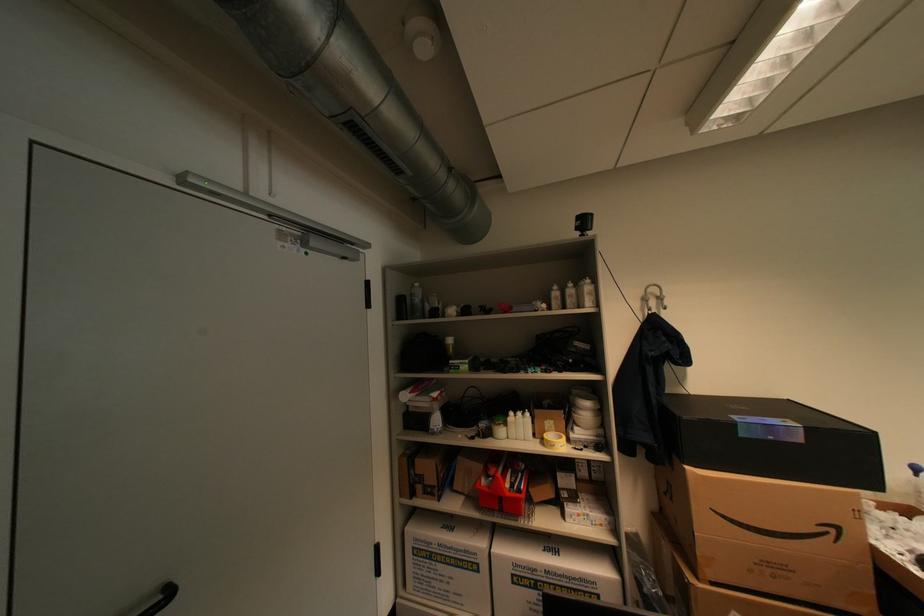
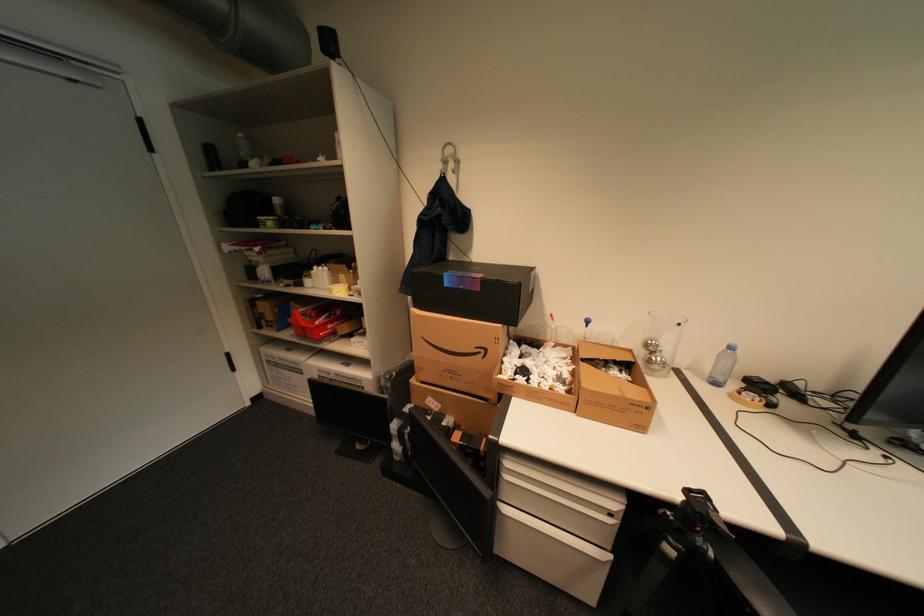
Question: In a continuous first-person perspective shot, in which direction is the camera moving?

Choices:
 (A) Left
 (B) Right
 (C) Forward
 (D) Backward

Answer: (B)